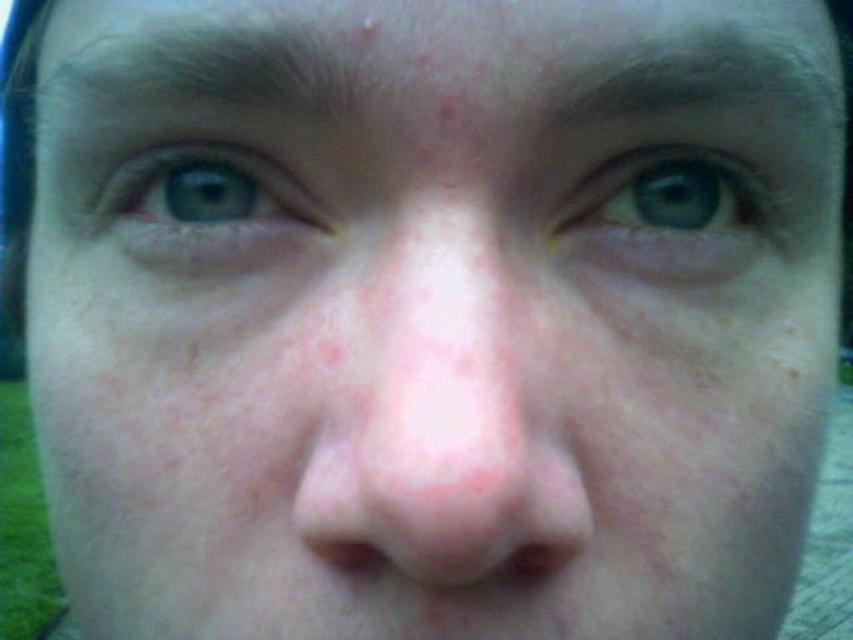
You are a photographer using a camera with a 35mm lens. You want to capture a close portrait of a person with their nose and forehead visible, similar to the image shown. If the point at coordinates point (440, 499) on the person is 7.18 inches away from the camera, what is the minimum distance you should maintain to ensure the entire face fits in the frame?

The minimum distance to maintain is 7.18 inches because the point at coordinates point (440, 499) on the person is 7.18 inches away from the camera, ensuring the entire face fits within the frame.

You are a dermatologist examining a patient. You notice the pink smooth nose at center and the blue matte eye at upper center. Which of these two body parts is closer to the camera?

The pink smooth nose at center is closer to the camera than the blue matte eye at upper center because it is positioned in front of it.